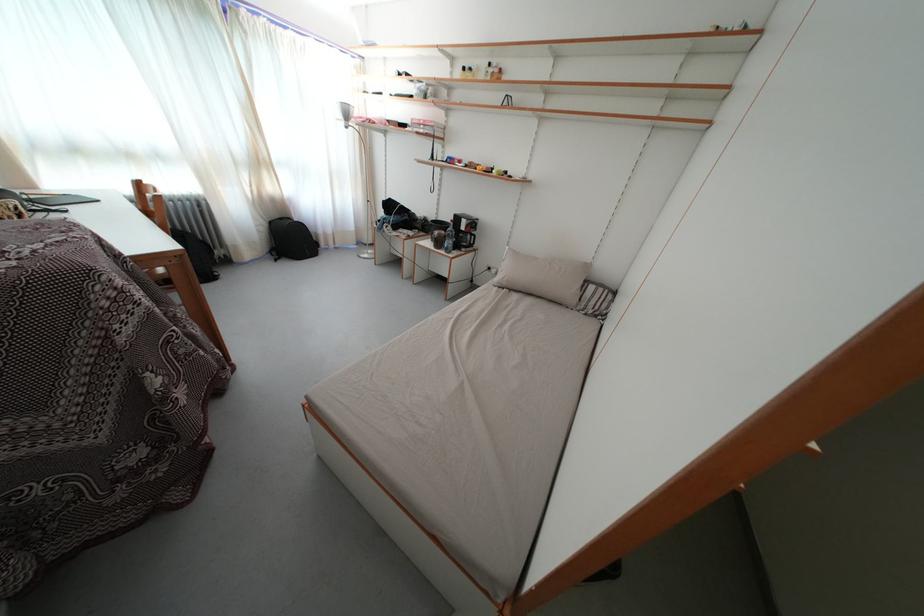
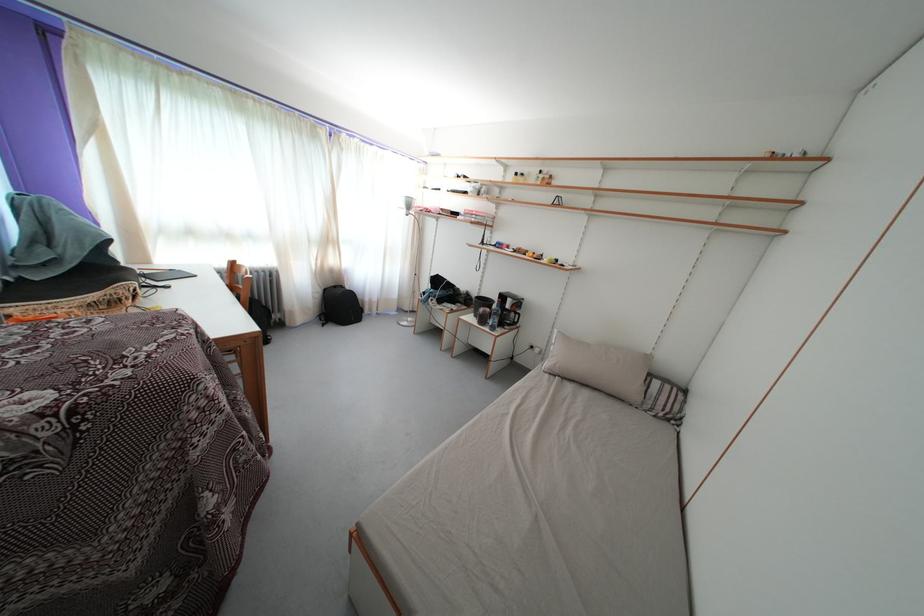
Question: The first image is from the beginning of the video and the second image is from the end. How did the camera likely rotate when shooting the video?

Choices:
 (A) Left
 (B) Right
 (C) Up
 (D) Down

Answer: (C)